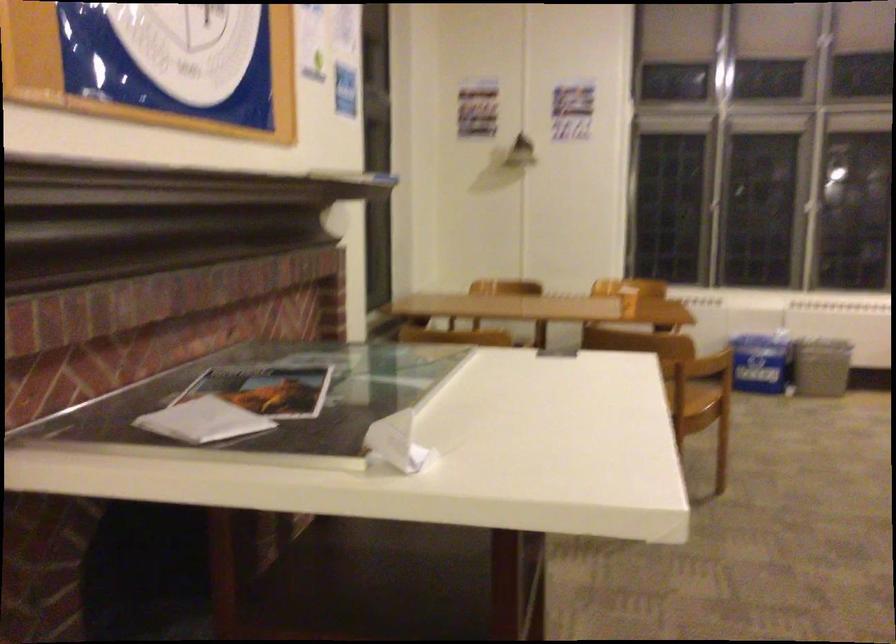
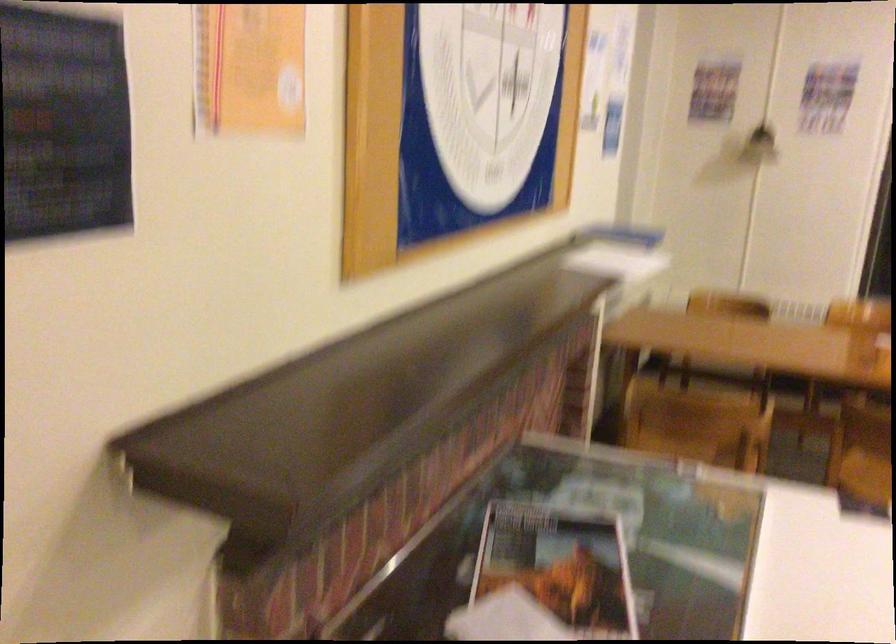
Locate, in the second image, the point that corresponds to point 339,172 in the first image.

(617, 252)